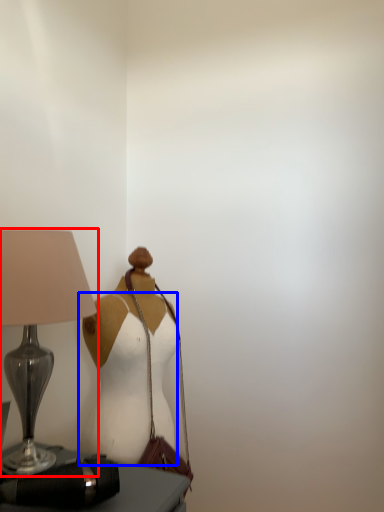
Question: Which object appears closest to the camera in this image, lamp (highlighted by a red box) or fancy dress (highlighted by a blue box)?

Choices:
 (A) lamp
 (B) fancy dress

Answer: (A)